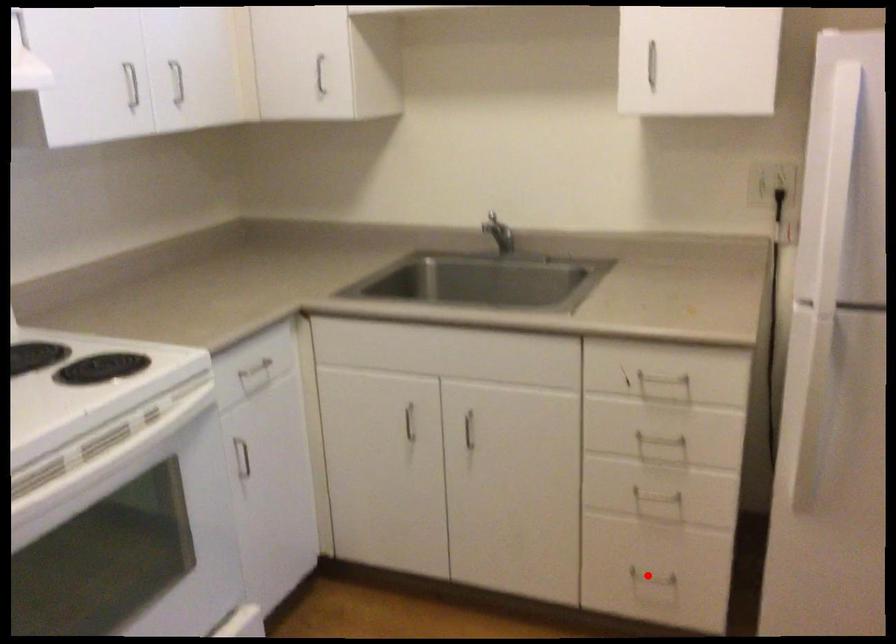
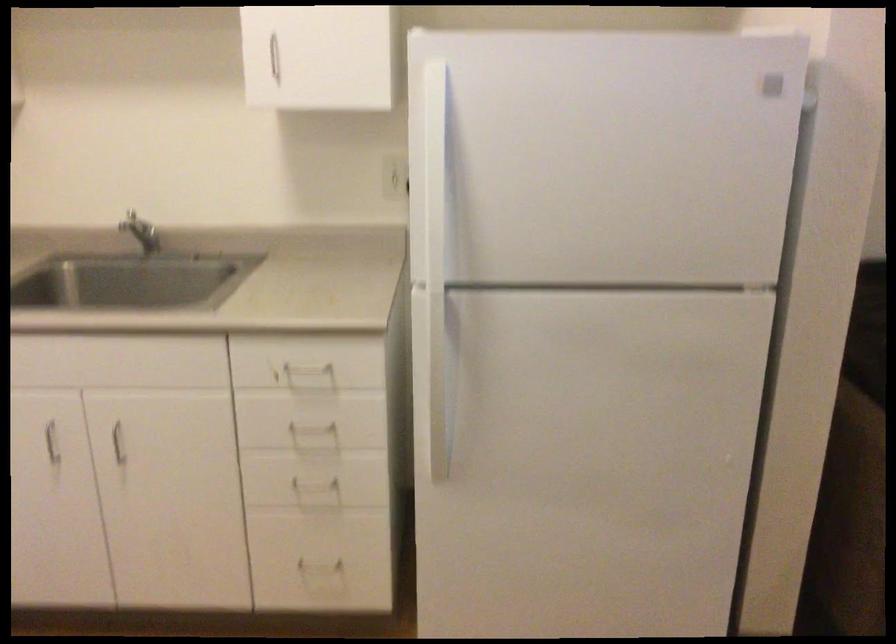
The point at the highlighted location is marked in the first image. Where is the corresponding point in the second image?

(317, 560)